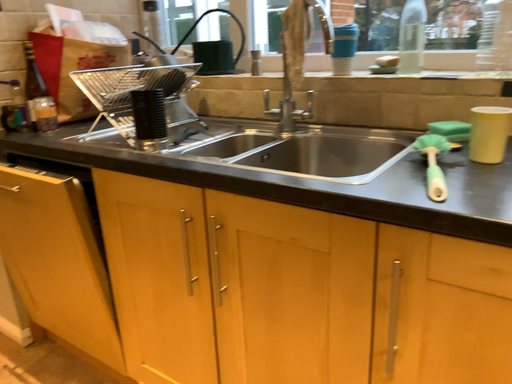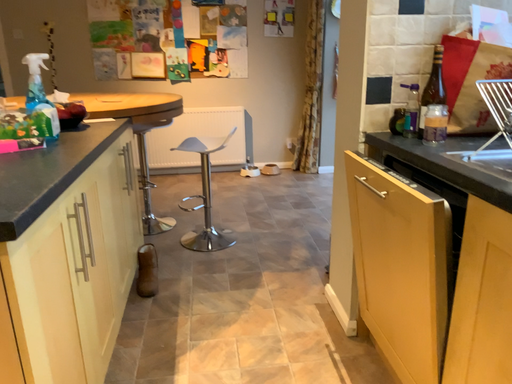
Question: Which way did the camera rotate in the video?

Choices:
 (A) rotated left
 (B) rotated right

Answer: (A)